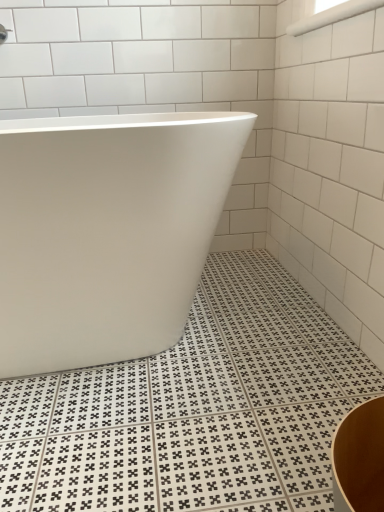
Question: Is white glossy grab bar at upper right taller or shorter than white glossy bathtub at center?

Choices:
 (A) tall
 (B) short

Answer: (B)

Question: In terms of size, does white glossy grab bar at upper right appear bigger or smaller than white glossy bathtub at center?

Choices:
 (A) big
 (B) small

Answer: (B)

Question: From a real-world perspective, is white glossy grab bar at upper right physically located above or below white glossy bathtub at center?

Choices:
 (A) above
 (B) below

Answer: (A)

Question: Is white glossy bathtub at center in front of or behind white glossy grab bar at upper right in the image?

Choices:
 (A) front
 (B) behind

Answer: (A)

Question: Would you say white glossy bathtub at center is to the left or to the right of white glossy grab bar at upper right in the picture?

Choices:
 (A) right
 (B) left

Answer: (B)

Question: Choose the correct answer: Is white glossy bathtub at center inside white glossy grab bar at upper right or outside it?

Choices:
 (A) outside
 (B) inside

Answer: (A)

Question: From a real-world perspective, is white glossy bathtub at center physically located above or below white glossy grab bar at upper right?

Choices:
 (A) above
 (B) below

Answer: (B)